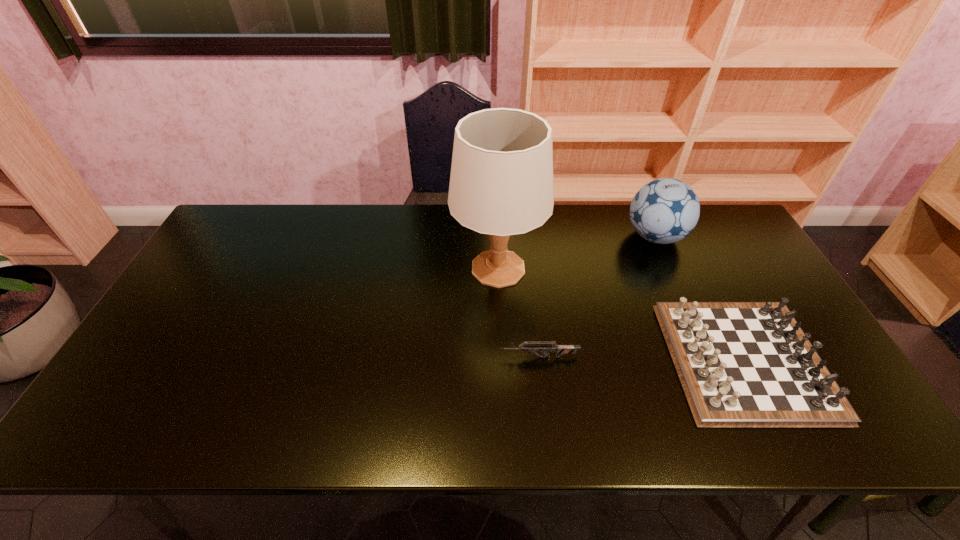
What are the coordinates of `vacant area at the near edge of the desktop` in the screenshot? It's located at (604, 430).

The width and height of the screenshot is (960, 540). In order to click on vacant space at the left edge of the desktop in this screenshot , I will do `click(173, 356)`.

The width and height of the screenshot is (960, 540). I want to click on vacant area at the right edge of the desktop, so click(772, 295).

Image resolution: width=960 pixels, height=540 pixels. Identify the location of vacant space at the near left corner of the desktop. (143, 414).

Where is `unoccupied position between the shortest object and the table lamp`? The image size is (960, 540). unoccupied position between the shortest object and the table lamp is located at coordinates (518, 313).

Locate an element on the screen. vacant space in between the second shortest object and the table lamp is located at coordinates (621, 314).

The height and width of the screenshot is (540, 960). What are the coordinates of `empty space that is in between the gun and the third tallest object` in the screenshot? It's located at (641, 359).

The image size is (960, 540). I want to click on free space between the second shortest object and the gun, so click(x=641, y=359).

Locate an element on the screen. This screenshot has height=540, width=960. unoccupied area between the second shortest object and the table lamp is located at coordinates (621, 314).

This screenshot has width=960, height=540. What are the coordinates of `vacant space that is in between the table lamp and the shortest object` in the screenshot? It's located at (518, 313).